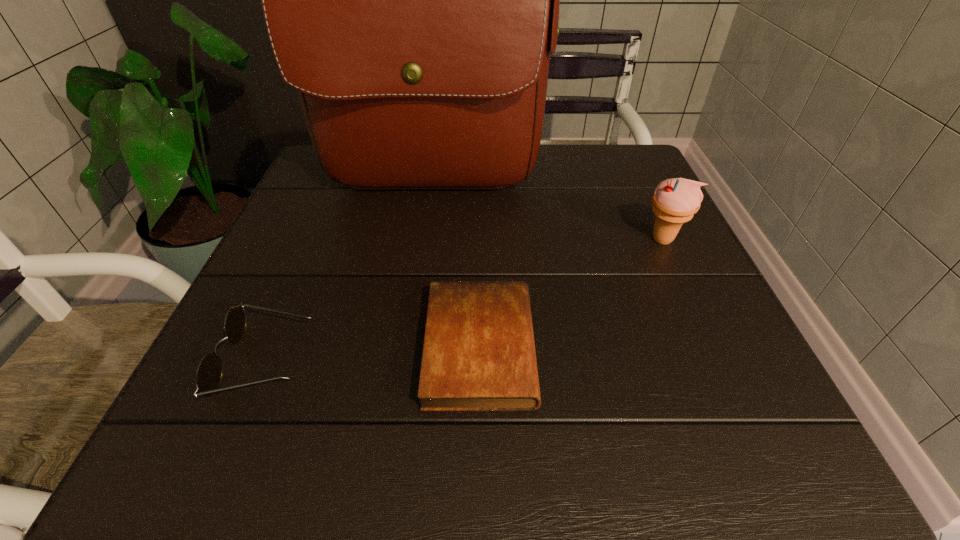
Where is `vacant region at the right edge of the desktop`? vacant region at the right edge of the desktop is located at coordinates (735, 397).

This screenshot has height=540, width=960. Find the location of `free space at the near left corner`. free space at the near left corner is located at coordinates (x=220, y=438).

Identify the location of vacant space at the far right corner. (x=620, y=176).

Find the location of `unoccupied area between the shortest object and the spectacles`. unoccupied area between the shortest object and the spectacles is located at coordinates (373, 354).

Image resolution: width=960 pixels, height=540 pixels. In order to click on free space between the spectacles and the farthest object in this screenshot , I will do `click(348, 274)`.

Find the location of `free space between the satchel and the second tallest object`. free space between the satchel and the second tallest object is located at coordinates (546, 214).

I want to click on free space between the Bible and the tallest object, so click(455, 268).

The image size is (960, 540). I want to click on free space between the tallest object and the icecream, so click(x=546, y=214).

What are the coordinates of `free area in between the satchel and the spectacles` in the screenshot? It's located at (348, 274).

Where is `empty space that is in between the second farthest object and the Bible`? empty space that is in between the second farthest object and the Bible is located at coordinates (571, 293).